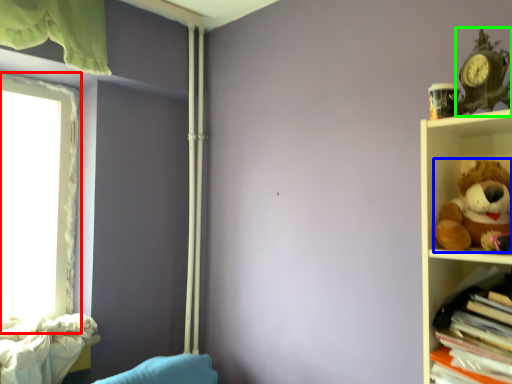
Question: Estimate the real-world distances between objects in this image. Which object is closer to window (highlighted by a red box), toy (highlighted by a blue box) or toy (highlighted by a green box)?

Choices:
 (A) toy
 (B) toy

Answer: (A)